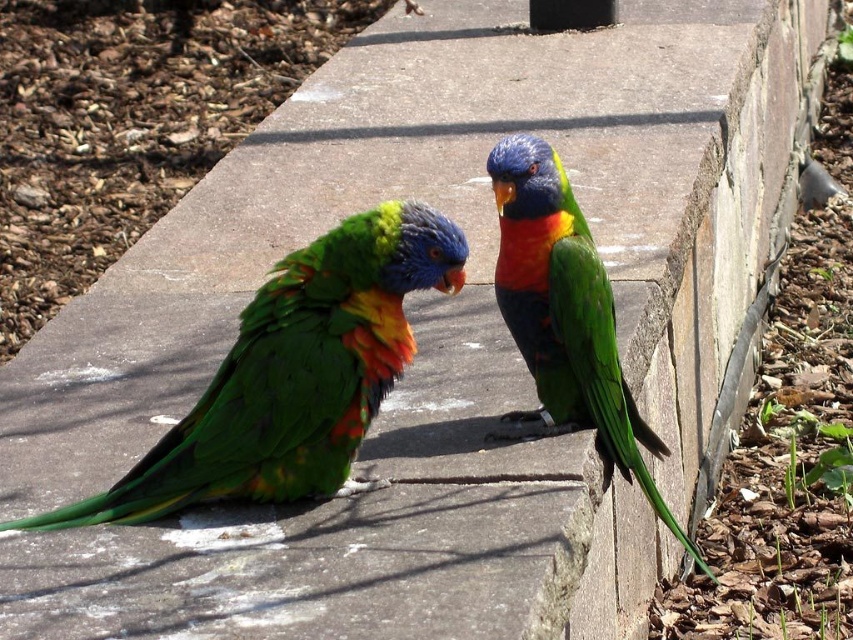
You are standing in front of the image of two lorikeets on a concrete ledge. You notice two points marked on the image. Which point, point (303, 428) or point (543, 164), is closer to you?

Point (303, 428) is closer to the viewer than point (543, 164).

You are a birdwatcher standing in front of the concrete ledge where two parrots are perched. You notice the multicolored feathered parrot at center and the shiny multicolored parrot at center. Which parrot would appear larger to you?

The multicolored feathered parrot at center is closer to the viewer than the shiny multicolored parrot at center, so it would appear larger.